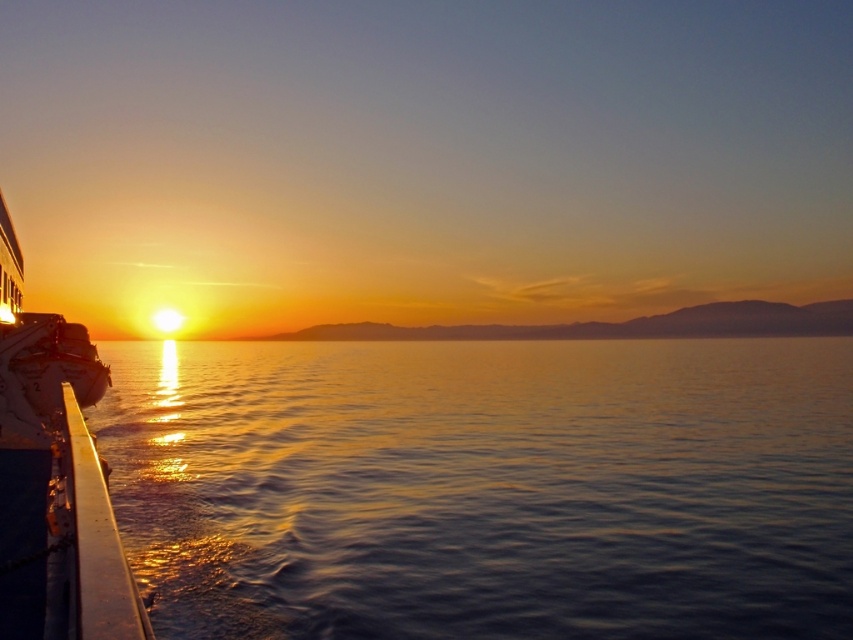
Can you confirm if glistening water at left is thinner than shiny silver boat at left?

No, glistening water at left is not thinner than shiny silver boat at left.

Who is more forward, (317, 387) or (33, 406)?

Point (33, 406)

Identify the location of glistening water at left. (485, 486).